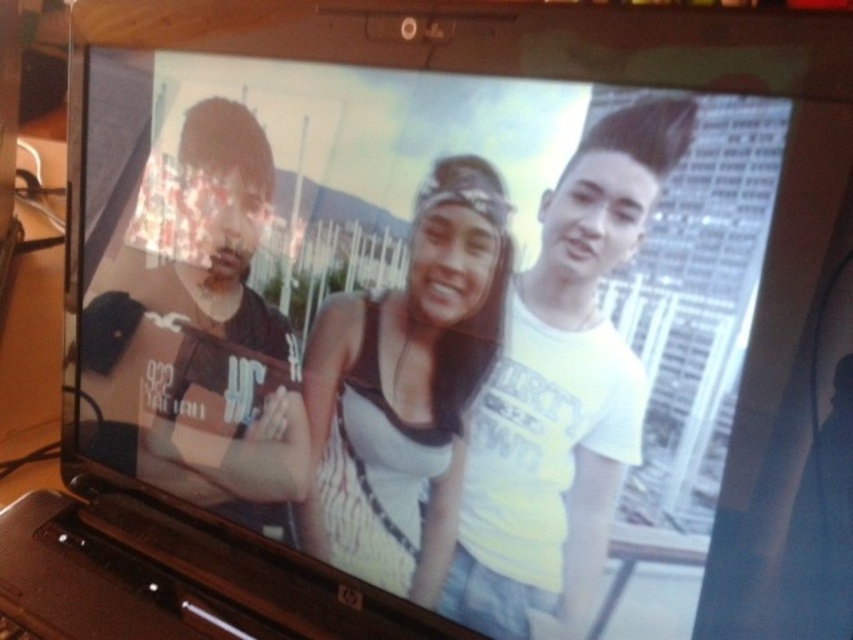
Question: Does matte black guitar at left have a greater width compared to white matte tank top at center?

Choices:
 (A) yes
 (B) no

Answer: (A)

Question: Can you confirm if matte black guitar at left is smaller than white matte tank top at center?

Choices:
 (A) no
 (B) yes

Answer: (A)

Question: Among these points, which one is farthest from the camera?

Choices:
 (A) (473, 337)
 (B) (274, 490)
 (C) (512, 330)

Answer: (B)

Question: Which object is closer to the camera taking this photo?

Choices:
 (A) matte black guitar at left
 (B) white matte tank top at center
 (C) white matte t-shirt at center

Answer: (C)

Question: Which of these objects is positioned closest to the matte black guitar at left?

Choices:
 (A) white matte tank top at center
 (B) white matte t-shirt at center

Answer: (A)

Question: Is white matte t-shirt at center to the left of matte black guitar at left from the viewer's perspective?

Choices:
 (A) yes
 (B) no

Answer: (B)